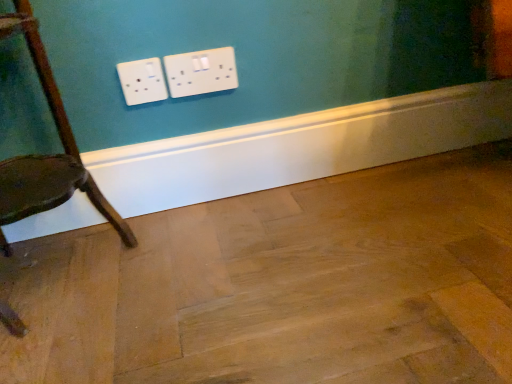
The image size is (512, 384). Describe the element at coordinates (283, 285) in the screenshot. I see `natural wood floor at center` at that location.

Measure the distance between point (306, 218) and camera.

Point (306, 218) and camera are 35.75 inches apart from each other.

Where is `natural wood floor at center`? natural wood floor at center is located at coordinates (283, 285).

The image size is (512, 384). Identify the location of wooden chair at left. (46, 155).

Describe the element at coordinates (46, 155) in the screenshot. I see `wooden chair at left` at that location.

This screenshot has height=384, width=512. Identify the location of natural wood floor at center. (283, 285).

Does natural wood floor at center appear on the right side of wooden chair at left?

Yes.

Is the depth of natural wood floor at center greater than that of wooden chair at left?

No, natural wood floor at center is closer to the camera.

Does point (177, 337) come farther from viewer compared to point (63, 185)?

No.

From the image's perspective, which one is positioned higher, natural wood floor at center or wooden chair at left?

wooden chair at left is shown above in the image.

From a real-world perspective, which is physically above, natural wood floor at center or wooden chair at left?

In real-world perspective, wooden chair at left is above.

Is natural wood floor at center wider or thinner than wooden chair at left?

Clearly, natural wood floor at center has more width compared to wooden chair at left.

Looking at this image, does natural wood floor at center have a greater height compared to wooden chair at left?

In fact, natural wood floor at center may be shorter than wooden chair at left.

Considering the relative sizes of natural wood floor at center and wooden chair at left in the image provided, is natural wood floor at center smaller than wooden chair at left?

Indeed, natural wood floor at center has a smaller size compared to wooden chair at left.

Is natural wood floor at center not inside wooden chair at left?

Indeed, natural wood floor at center is completely outside wooden chair at left.

Is the surface of natural wood floor at center in direct contact with wooden chair at left?

There is a gap between natural wood floor at center and wooden chair at left.

Is natural wood floor at center facing towards wooden chair at left?

No, natural wood floor at center is not turned towards wooden chair at left.

How many degrees apart are the facing directions of natural wood floor at center and wooden chair at left?

There is a 0.327-degree angle between the facing directions of natural wood floor at center and wooden chair at left.

This screenshot has height=384, width=512. In order to click on chair located behind the natural wood floor at center in this screenshot , I will do `click(46, 155)`.

Is wooden chair at left at the right side of natural wood floor at center?

Incorrect, wooden chair at left is not on the right side of natural wood floor at center.

Considering their positions, is wooden chair at left located in front of or behind natural wood floor at center?

Clearly, wooden chair at left is behind natural wood floor at center.

Is point (61, 191) closer to viewer compared to point (457, 327)?

No, it is behind (457, 327).

From the image's perspective, would you say wooden chair at left is shown under natural wood floor at center?

No.

From a real-world perspective, which object rests below the other?

natural wood floor at center.

Considering the sizes of objects wooden chair at left and natural wood floor at center in the image provided, who is wider, wooden chair at left or natural wood floor at center?

natural wood floor at center is wider.

Considering the sizes of objects wooden chair at left and natural wood floor at center in the image provided, who is taller, wooden chair at left or natural wood floor at center?

Standing taller between the two is wooden chair at left.

Is wooden chair at left smaller than natural wood floor at center?

No, wooden chair at left is not smaller than natural wood floor at center.

Based on the photo, is natural wood floor at center inside wooden chair at left?

No, natural wood floor at center is located outside of wooden chair at left.

Is wooden chair at left with natural wood floor at center?

No.

In the scene shown: Is natural wood floor at center at the back of wooden chair at left?

That's not correct — wooden chair at left is not looking away from natural wood floor at center.

What's the angular difference between wooden chair at left and natural wood floor at center's facing directions?

wooden chair at left and natural wood floor at center are facing 0.327 degrees away from each other.

Measure the distance between wooden chair at left and natural wood floor at center.

A distance of 11.36 inches exists between wooden chair at left and natural wood floor at center.

The height and width of the screenshot is (384, 512). What are the coordinates of `plywood located on the right of wooden chair at left` in the screenshot? It's located at (283, 285).

You are a GUI agent. You are given a task and a screenshot of the screen. Output one action in this format:
    pyautogui.click(x=<x>, y=<y>)
    Task: Click on the chair that appears behind the natural wood floor at center
    Image resolution: width=512 pixels, height=384 pixels.
    Given the screenshot: What is the action you would take?
    pyautogui.click(x=46, y=155)

This screenshot has height=384, width=512. I want to click on plywood directly beneath the wooden chair at left (from a real-world perspective), so click(x=283, y=285).